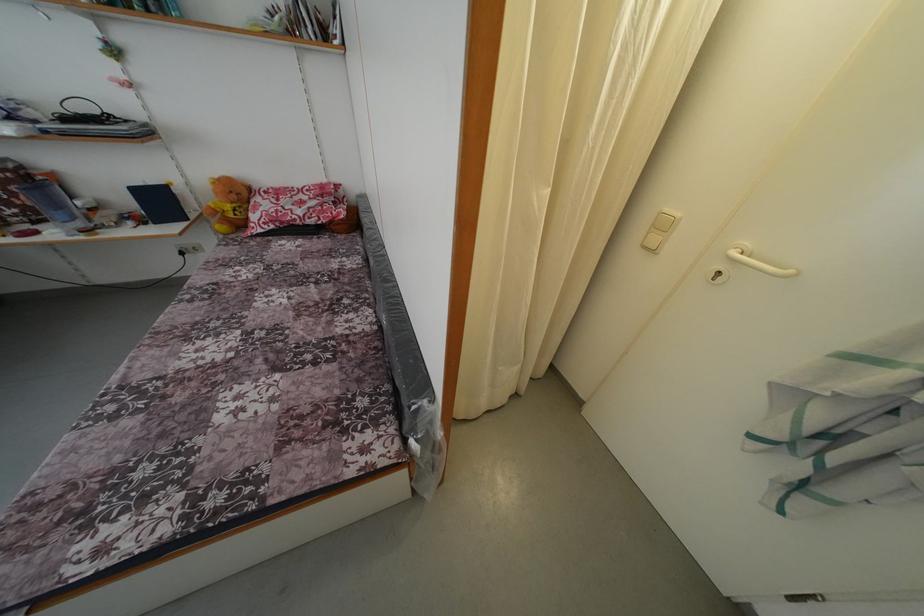
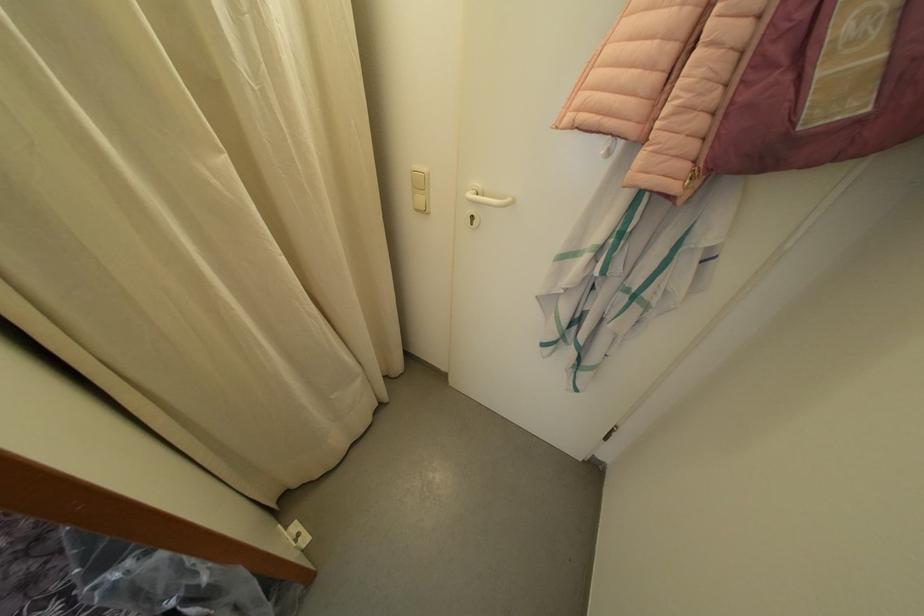
In the second image, find the point that corresponds to point 752,251 in the first image.

(482, 190)